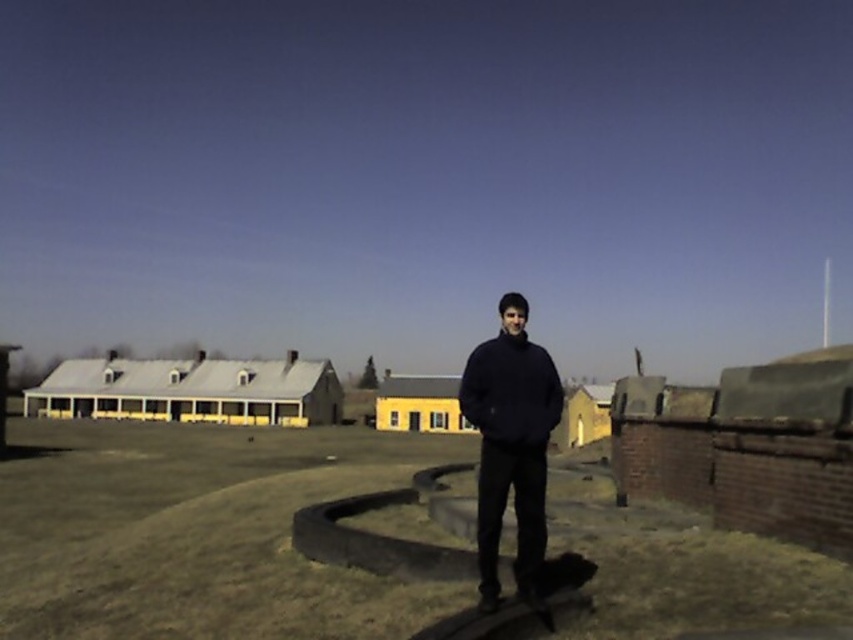
In the scene shown: You are a photographer trying to capture a photo of the two people wearing the dark blue sweater at center and the black matte sweatshirt at center. Which one should you focus on first if you want to include both in your shot without moving the camera?

The dark blue sweater at center should be focused on first since it is positioned on the left side of the black matte sweatshirt at center, allowing the photographer to frame both subjects in the shot by centering the left one first.

You are standing at the curved stone structure and want to take a photo of both point (490, 592) and point (521, 433) in the scene. Which point should you focus on first to ensure both are in the frame?

You should focus on point (490, 592) first because it is closer to you than point (521, 433). By focusing on the closer point, the depth of field may include the farther point as well, ensuring both are in the frame.

You are standing at the curved stone structure in the foreground of the image. You want to touch the point located at coordinates point (x=509, y=444). Can you reach it without moving from your current position?

The point (x=509, y=444) is on dark blue sweater at center, so yes, you can reach it without moving since it is on your own clothing.